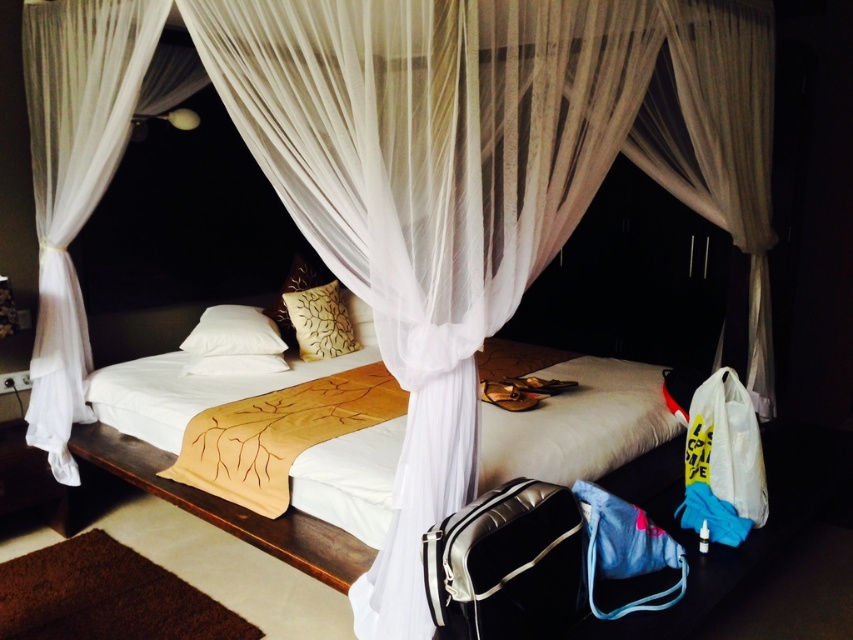
Question: Is white fabric bed at center positioned in front of white soft pillow at center?

Choices:
 (A) no
 (B) yes

Answer: (B)

Question: Which of these objects is positioned closest to the white sheer curtain at left?

Choices:
 (A) white soft pillow at center
 (B) white fabric bed at center
 (C) brown textured pillow at center
 (D) white soft pillow at upper left

Answer: (D)

Question: Which point appears closest to the camera in this image?

Choices:
 (A) (193, 332)
 (B) (210, 362)
 (C) (331, 285)

Answer: (B)

Question: Which object is the farthest from the white sheer curtain at left?

Choices:
 (A) white soft pillow at center
 (B) gold embroidered blanket at center
 (C) white fabric bed at center

Answer: (C)

Question: Does white fabric bed at center have a greater width compared to white sheer curtain at left?

Choices:
 (A) no
 (B) yes

Answer: (B)

Question: Can you confirm if brown textured pillow at center is thinner than white soft pillow at upper left?

Choices:
 (A) yes
 (B) no

Answer: (A)